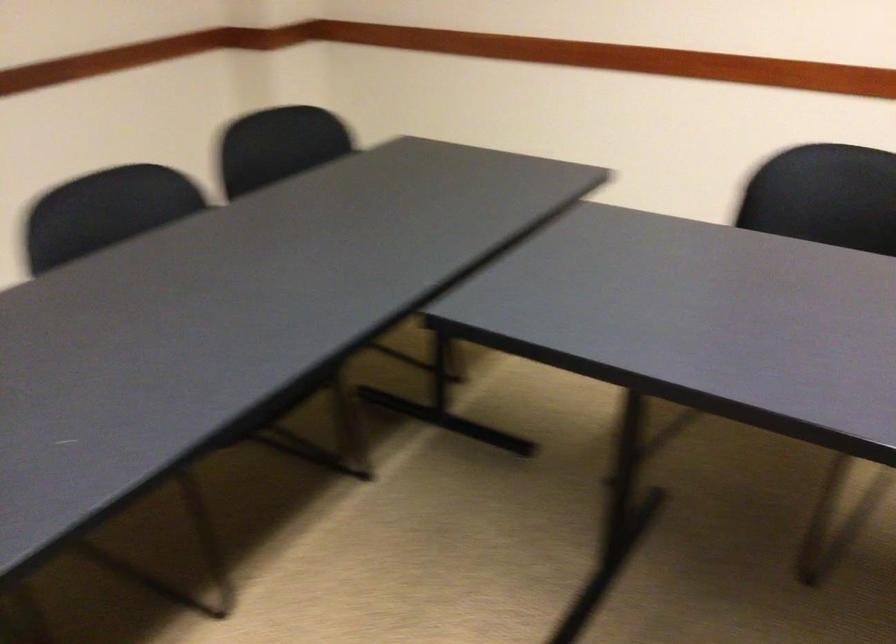
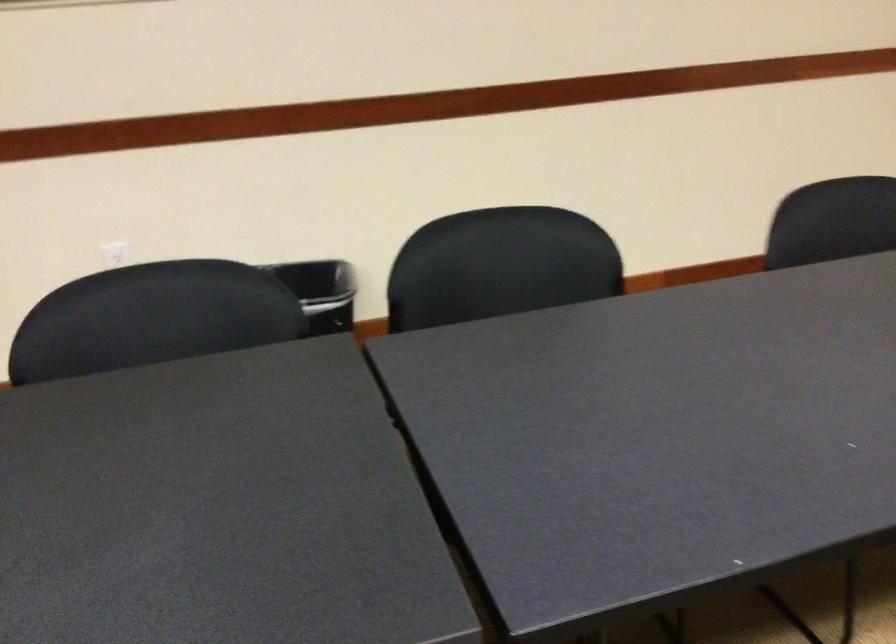
Question: The camera is either moving clockwise (left) or counter-clockwise (right) around the object. The first image is from the beginning of the video and the second image is from the end. Is the camera moving left or right when shooting the video?

Choices:
 (A) Left
 (B) Right

Answer: (B)